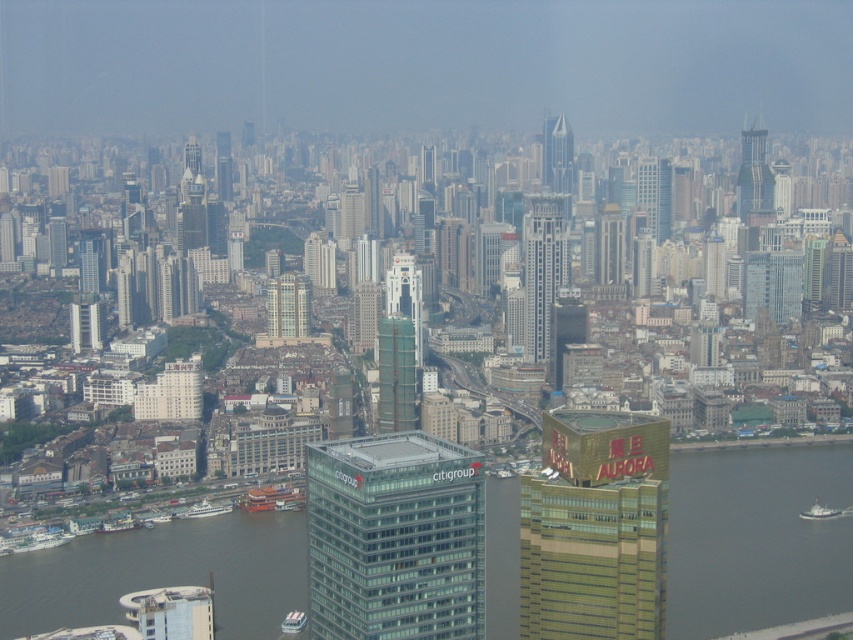
You are a drone operator tasked with flying a drone between the transparent glass skyscraper at center and the glassy reflective skyscraper at upper right. The drone has a maximum flight distance of 200 meters. Can the drone safely complete this flight without exceeding its range?

The distance between the transparent glass skyscraper at center and the glassy reflective skyscraper at upper right is 222.32 meters, which exceeds the drone operator stated maximum flight distance of 200 meters. Therefore, the drone cannot safely complete the flight without exceeding its range.

You are a drone operator tasked with capturing aerial footage of the cityscape. Your drone is currently positioned at the center of the image. You need to adjust the camera to focus on the glassy reflective skyscraper at upper right. Which direction should you tilt the camera to aim it properly?

The glassy reflective skyscraper at upper right is located at coordinates point (753, 173), which is in the upper right quadrant of the image. Since the drone is at the center, tilting the camera upward and to the right will align it with the skyscraper.

You are a drone operator tasked with capturing aerial footage of the city. Your drone has a maximum flight range of 500 meters. You want to fly it to the glassy reflective skyscraper at upper right. Can your drone reach it?

The glassy reflective skyscraper at upper right is 555.33 meters from the camera, which exceeds the drone operator drone maximum flight range of 500 meters. Therefore, the drone cannot reach it.